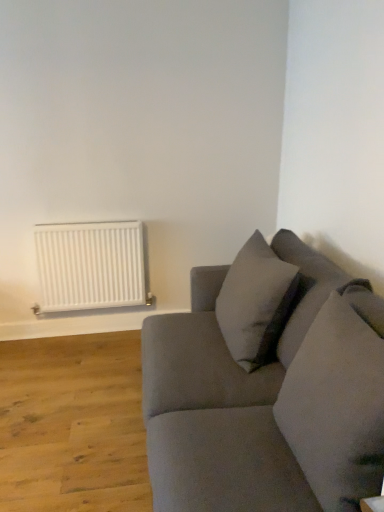
Question: Can you confirm if white matte radiator at left is smaller than soft gray pillow at upper right, the first pillow from the back?

Choices:
 (A) yes
 (B) no

Answer: (A)

Question: Does white matte radiator at left lie in front of soft gray pillow at upper right, arranged as the 2th pillow when viewed from the front?

Choices:
 (A) no
 (B) yes

Answer: (A)

Question: Is white matte radiator at left oriented away from soft gray pillow at upper right, the first pillow from the back?

Choices:
 (A) no
 (B) yes

Answer: (A)

Question: From a real-world perspective, is white matte radiator at left positioned under soft gray pillow at upper right, arranged as the 2th pillow when viewed from the front, based on gravity?

Choices:
 (A) yes
 (B) no

Answer: (A)

Question: Is white matte radiator at left to the left of soft gray pillow at upper right, the first pillow from the back, from the viewer's perspective?

Choices:
 (A) no
 (B) yes

Answer: (B)

Question: From a real-world perspective, is suede gray couch at right physically located above or below white matte radiator at left?

Choices:
 (A) below
 (B) above

Answer: (A)

Question: Considering the positions of suede gray couch at right and white matte radiator at left in the image, is suede gray couch at right taller or shorter than white matte radiator at left?

Choices:
 (A) tall
 (B) short

Answer: (A)

Question: In the image, is suede gray couch at right positioned in front of or behind white matte radiator at left?

Choices:
 (A) front
 (B) behind

Answer: (A)

Question: Based on their sizes in the image, would you say suede gray couch at right is bigger or smaller than white matte radiator at left?

Choices:
 (A) big
 (B) small

Answer: (A)

Question: From a real-world perspective, is suede-like gray pillow at right, which is the 1th pillow in front-to-back order, physically located above or below suede gray couch at right?

Choices:
 (A) below
 (B) above

Answer: (B)

Question: Looking at their shapes, would you say suede-like gray pillow at right, which is the 2th pillow from back to front, is wider or thinner than suede gray couch at right?

Choices:
 (A) thin
 (B) wide

Answer: (A)

Question: Considering their positions, is suede-like gray pillow at right, which is the 1th pillow in front-to-back order, located in front of or behind suede gray couch at right?

Choices:
 (A) front
 (B) behind

Answer: (B)

Question: Is point (299, 394) positioned closer to the camera than point (173, 331)?

Choices:
 (A) farther
 (B) closer

Answer: (B)

Question: Do you think suede gray couch at right is within soft gray pillow at upper right, arranged as the 2th pillow when viewed from the front, or outside of it?

Choices:
 (A) outside
 (B) inside

Answer: (A)

Question: Considering the positions of suede gray couch at right and soft gray pillow at upper right, arranged as the 2th pillow when viewed from the front, in the image, is suede gray couch at right taller or shorter than soft gray pillow at upper right, arranged as the 2th pillow when viewed from the front,?

Choices:
 (A) short
 (B) tall

Answer: (B)